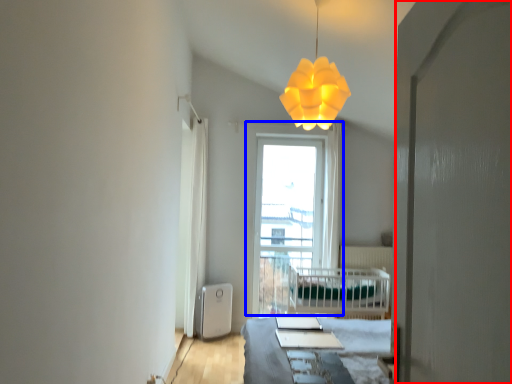
Question: Among these objects, which one is nearest to the camera, screen door (highlighted by a red box) or window (highlighted by a blue box)?

Choices:
 (A) screen door
 (B) window

Answer: (A)